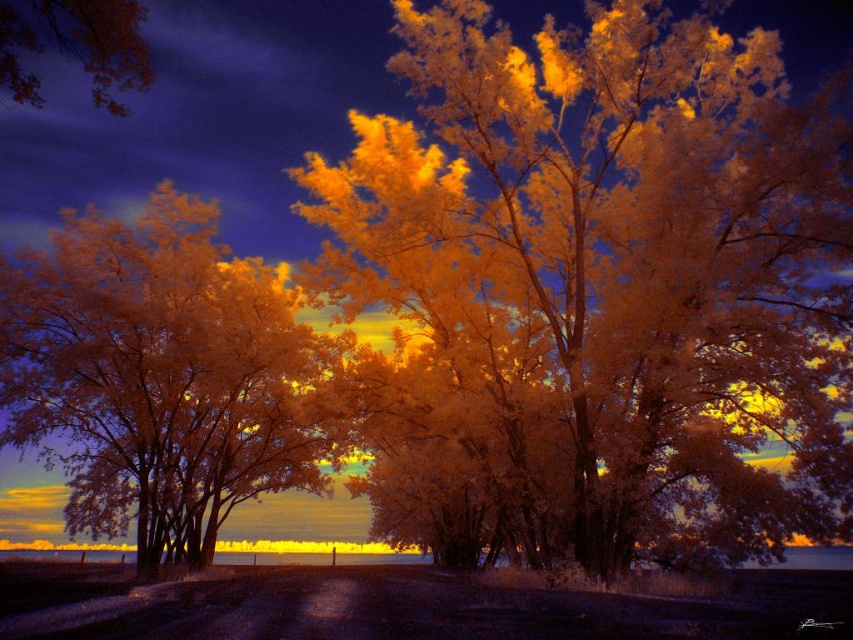
Question: Is golden textured tree at center in front of orange leafy tree at upper left?

Choices:
 (A) yes
 (B) no

Answer: (B)

Question: Estimate the real-world distances between objects in this image. Which object is closer to the orange leafy tree at upper left?

Choices:
 (A) golden translucent tree at center
 (B) golden textured tree at center

Answer: (A)

Question: Is golden textured tree at center closer to the viewer compared to golden translucent tree at center?

Choices:
 (A) no
 (B) yes

Answer: (B)

Question: Is golden textured tree at center behind orange leafy tree at upper left?

Choices:
 (A) no
 (B) yes

Answer: (B)

Question: Which object is farther from the camera taking this photo?

Choices:
 (A) golden translucent tree at center
 (B) orange leafy tree at upper left

Answer: (A)

Question: Considering the real-world distances, which object is farthest from the orange leafy tree at upper left?

Choices:
 (A) golden translucent tree at center
 (B) golden textured tree at center

Answer: (B)